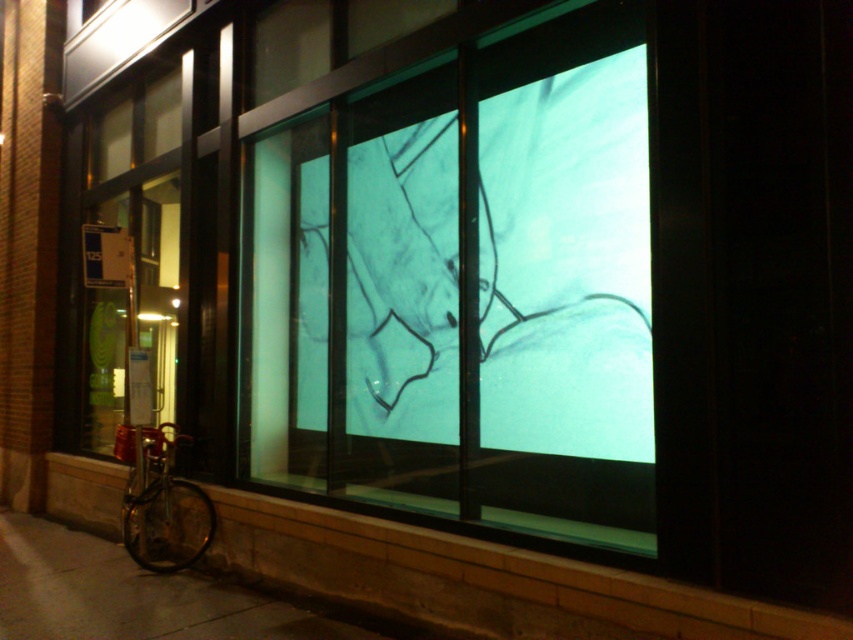
Question: Can you confirm if transparent glass drawing at center is positioned to the left of shiny metallic bicycle at lower left?

Choices:
 (A) yes
 (B) no

Answer: (B)

Question: Can you confirm if transparent glass drawing at center is thinner than shiny metallic bicycle at lower left?

Choices:
 (A) no
 (B) yes

Answer: (A)

Question: Can you confirm if transparent glass drawing at center is bigger than shiny metallic bicycle at lower left?

Choices:
 (A) yes
 (B) no

Answer: (A)

Question: Which object is closer to the camera taking this photo?

Choices:
 (A) shiny metallic bicycle at lower left
 (B) transparent glass drawing at center

Answer: (B)